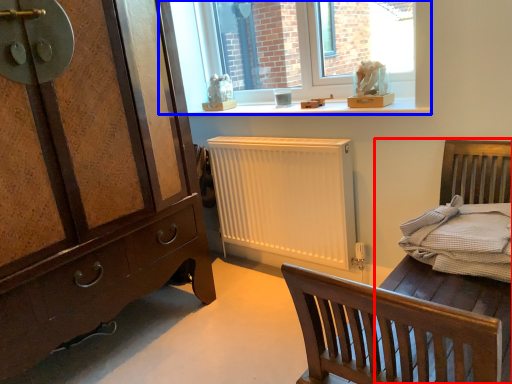
Question: Which object appears closest to the camera in this image, bed frame (highlighted by a red box) or window (highlighted by a blue box)?

Choices:
 (A) bed frame
 (B) window

Answer: (A)